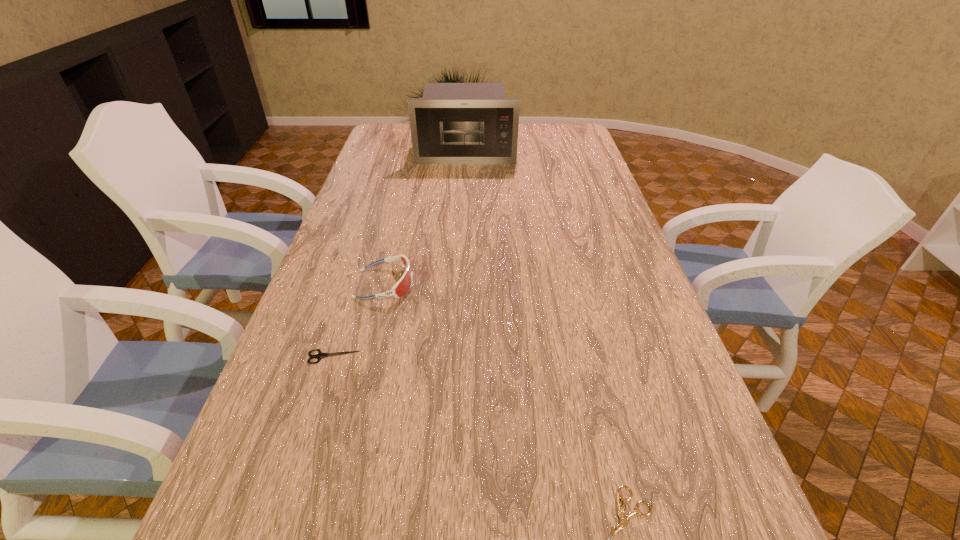
Identify which object is the second closest to the third shortest object. Please provide its 2D coordinates. Your answer should be formatted as a tuple, i.e. [(x, y)], where the tuple contains the x and y coordinates of a point satisfying the conditions above.

[(623, 518)]

I want to click on the third closest object to the nearer shears, so click(x=453, y=123).

The image size is (960, 540). I want to click on vacant position in the image that satisfies the following two spatial constraints: 1. on the front-facing side of the second tallest object; 2. on the front side of the farther shears, so click(368, 357).

Where is `vacant area that satisfies the following two spatial constraints: 1. on the front-facing side of the farthest object; 2. on the front-facing side of the second farthest object`? vacant area that satisfies the following two spatial constraints: 1. on the front-facing side of the farthest object; 2. on the front-facing side of the second farthest object is located at coordinates (459, 284).